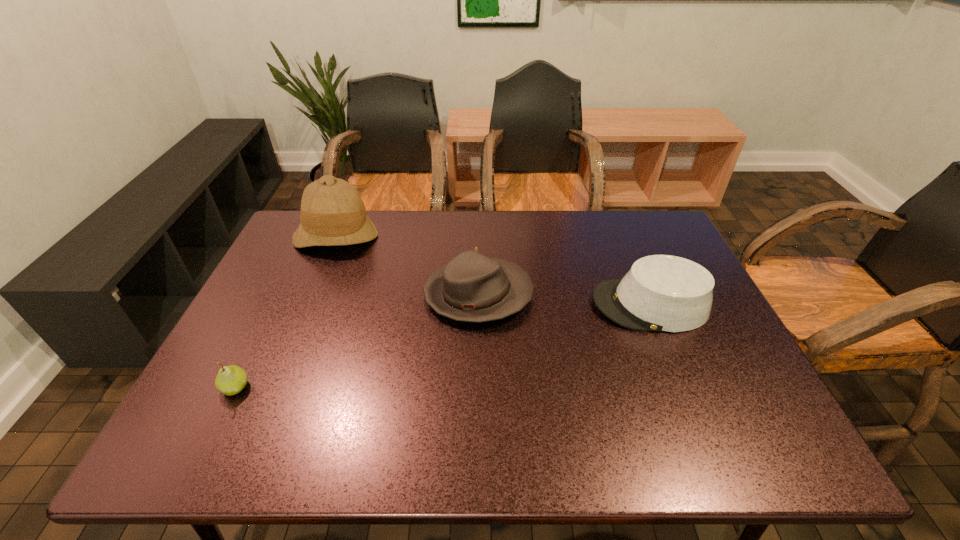
Image resolution: width=960 pixels, height=540 pixels. Identify the location of the tallest object. (332, 213).

The image size is (960, 540). What are the coordinates of `the farthest hat` in the screenshot? It's located at click(332, 213).

In order to click on the second hat from left to right in this screenshot , I will do `click(471, 287)`.

You are a GUI agent. You are given a task and a screenshot of the screen. Output one action in this format:
    pyautogui.click(x=<x>, y=<y>)
    Task: Click on the rightmost object
    
    Given the screenshot: What is the action you would take?
    665,293

Locate an element on the screen. This screenshot has height=540, width=960. pear is located at coordinates (230, 380).

You are a GUI agent. You are given a task and a screenshot of the screen. Output one action in this format:
    pyautogui.click(x=<x>, y=<y>)
    Task: Click on the vacant space located on the front-facing side of the farthest object
    The image size is (960, 540).
    Given the screenshot: What is the action you would take?
    pyautogui.click(x=294, y=336)

Where is `free spot located 0.160m on the decorative side of the second object from right to left`? free spot located 0.160m on the decorative side of the second object from right to left is located at coordinates (591, 295).

Identify the location of vacant space located 0.050m on the front-facing side of the rightmost object. Image resolution: width=960 pixels, height=540 pixels. (573, 305).

Identify the location of free space located 0.250m on the front-facing side of the rightmost object. (499, 305).

Find the location of a particular element. Image resolution: width=960 pixels, height=540 pixels. free space located 0.300m on the front-facing side of the rightmost object is located at coordinates (480, 305).